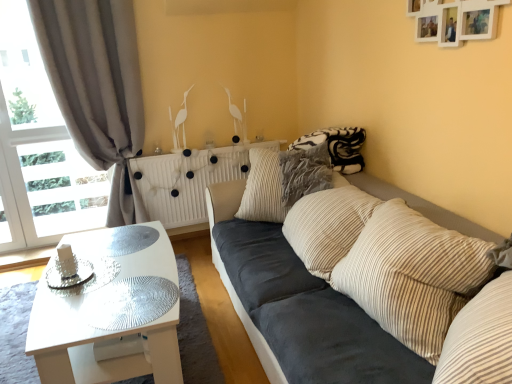
The width and height of the screenshot is (512, 384). Identify the location of free point above white glossy coffee table at lower left (from a real-world perspective). (103, 275).